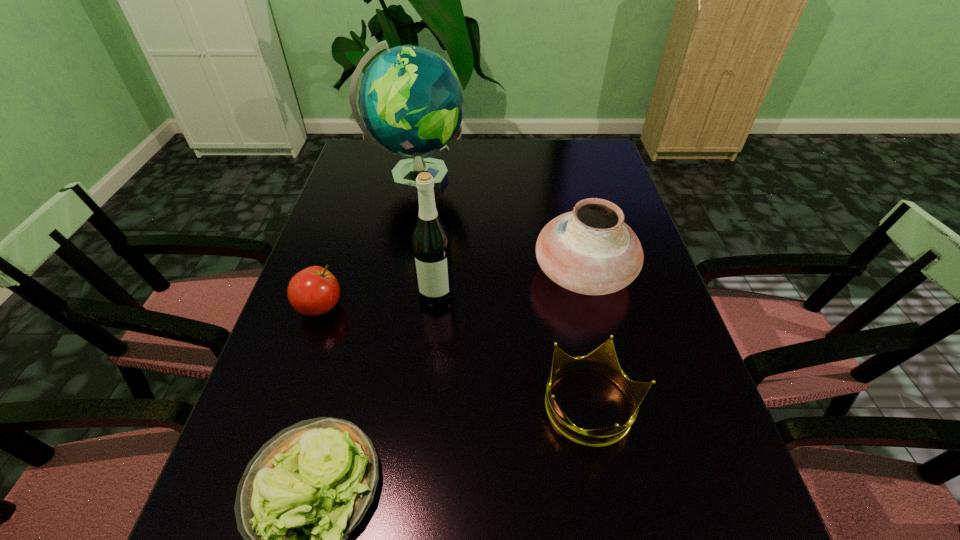
Select which object is the second closest to the crown. Please provide its 2D coordinates. Your answer should be formatted as a tuple, i.e. [(x, y)], where the tuple contains the x and y coordinates of a point satisfying the conditions above.

[(431, 247)]

Identify the location of blank space that satisfies the following two spatial constraints: 1. on the front surface of the pottery; 2. on the right side of the farthest object. Image resolution: width=960 pixels, height=540 pixels. (398, 273).